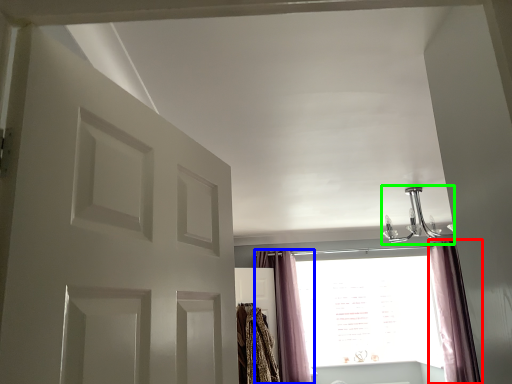
Question: Which object is positioned closest to curtain (highlighted by a red box)? Select from curtain (highlighted by a blue box) and light fixture (highlighted by a green box).

Choices:
 (A) curtain
 (B) light fixture

Answer: (B)